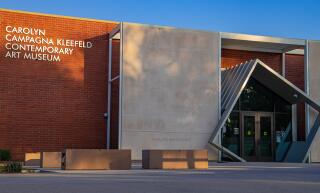
I want to click on glass panes to the side of entry doors, so click(x=232, y=125), click(x=281, y=123).